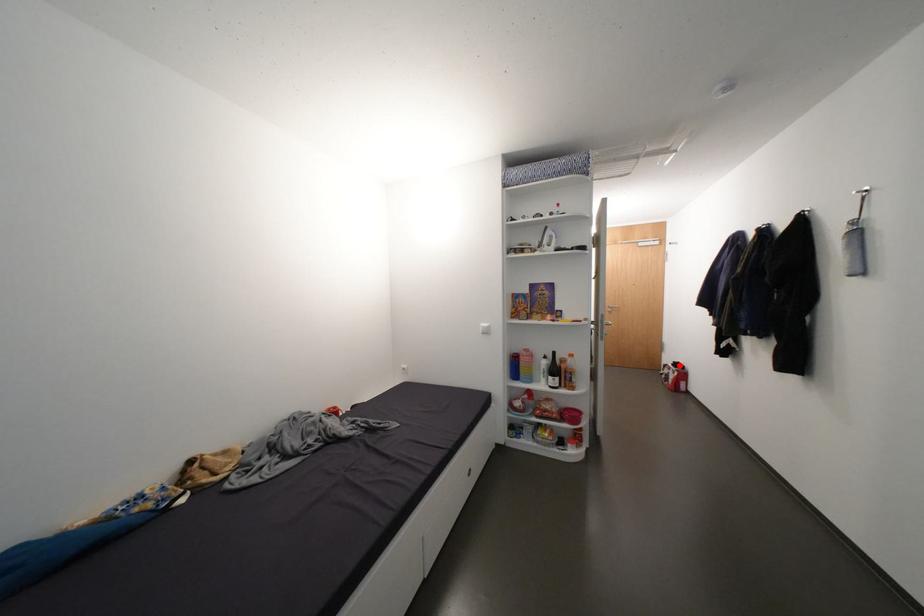
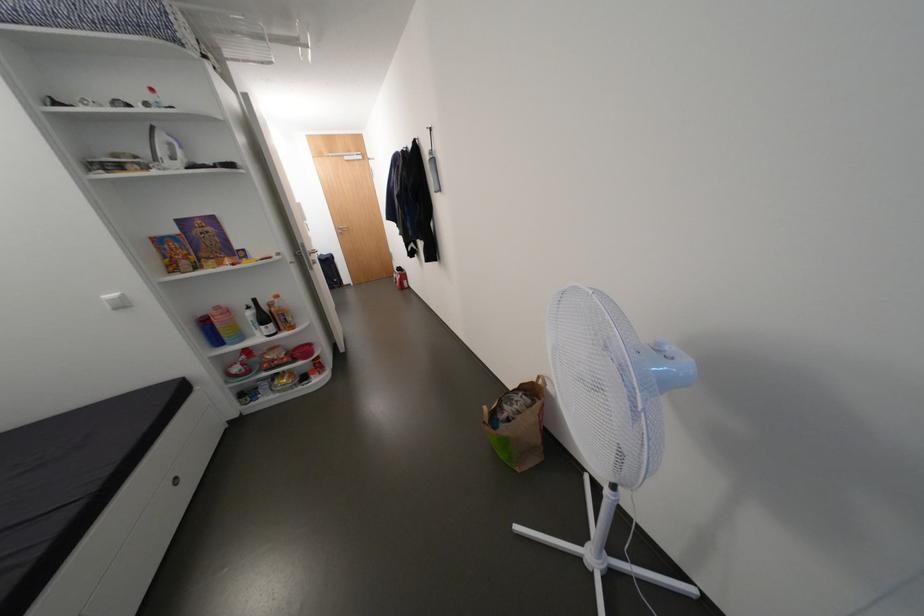
The point at the highlighted location is marked in the first image. Where is the corresponding point in the second image?

(405, 270)